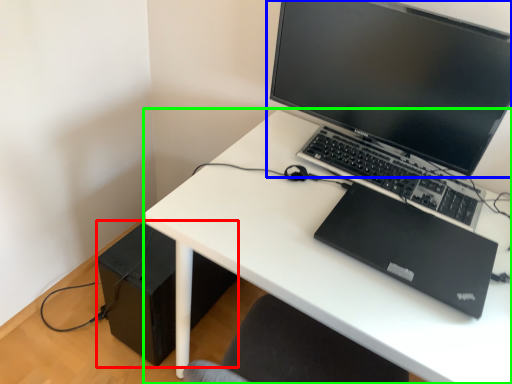
Question: Considering the real-world distances, which object is farthest from speaker (highlighted by a red box)? computer monitor (highlighted by a blue box) or desk (highlighted by a green box)?

Choices:
 (A) computer monitor
 (B) desk

Answer: (A)